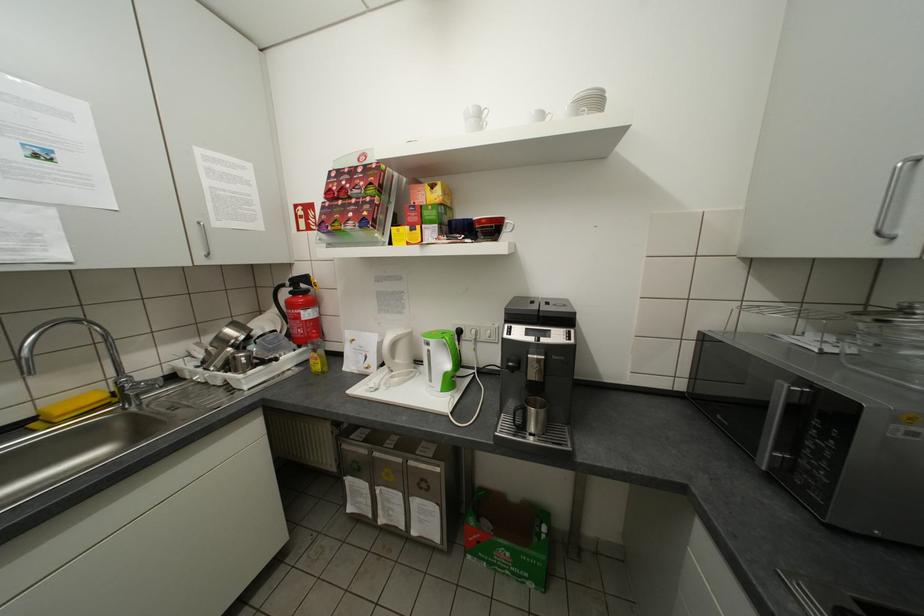
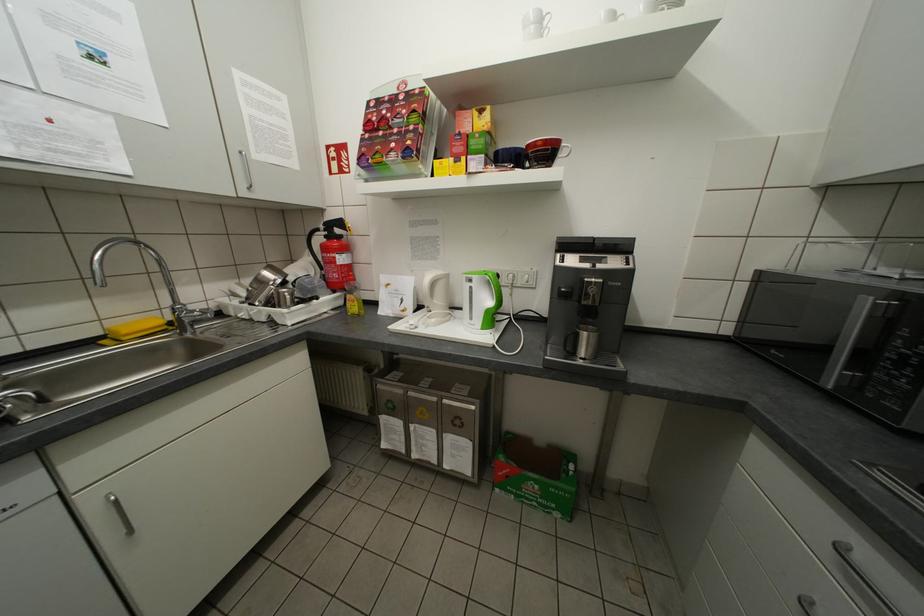
Find the pixel in the second image that matches the point at 353,446 in the first image.

(387, 387)